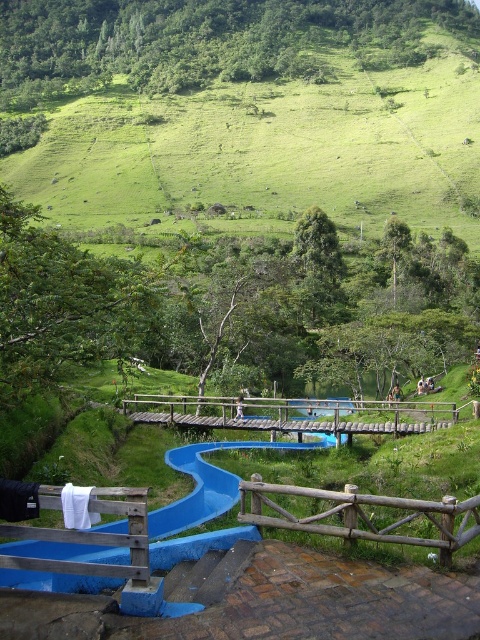
You are a visitor at this recreational area and want to cross to the other side of the ravine. The wooden bridge at center and the brown wooden fence at lower center are in your path. Which object should you approach first to reach the bridge?

You should approach the brown wooden fence at lower center first because the wooden bridge at center is to the right of it, so you must pass the brown wooden fence at lower center before reaching the bridge.